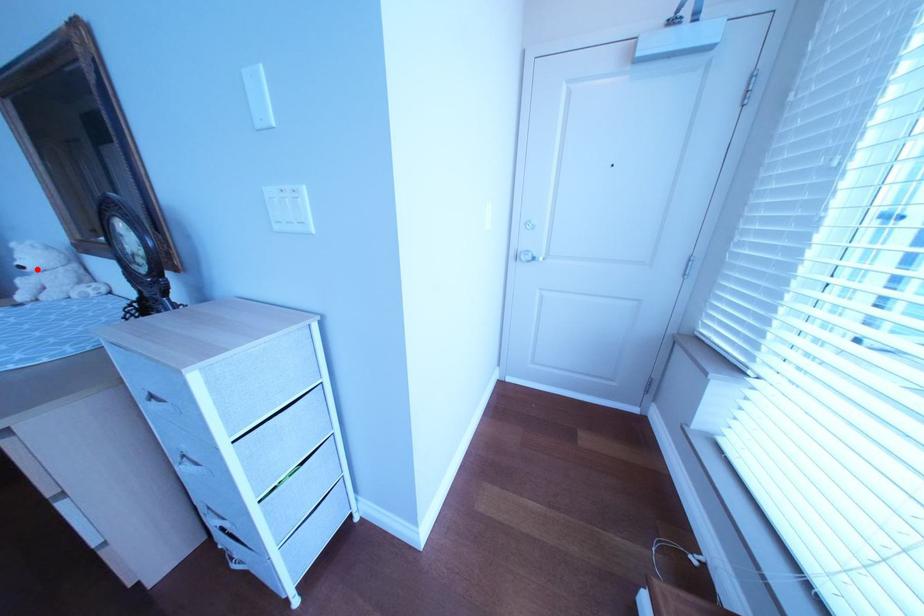
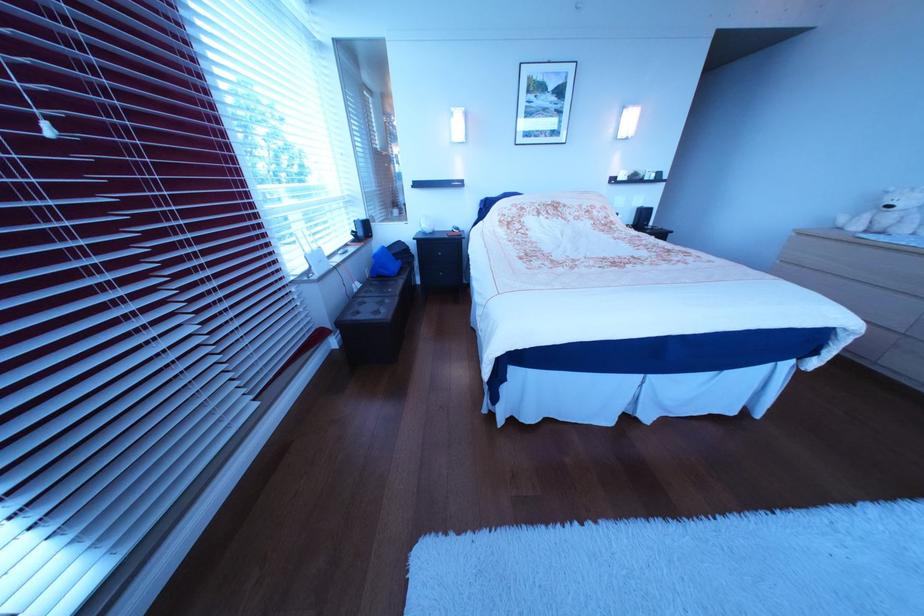
Question: I am providing you with two images of the same scene from different viewpoints. A red point is shown in image1. For the corresponding object point in image2, is it positioned nearer or farther from the camera?

Choices:
 (A) Nearer
 (B) Farther

Answer: (B)